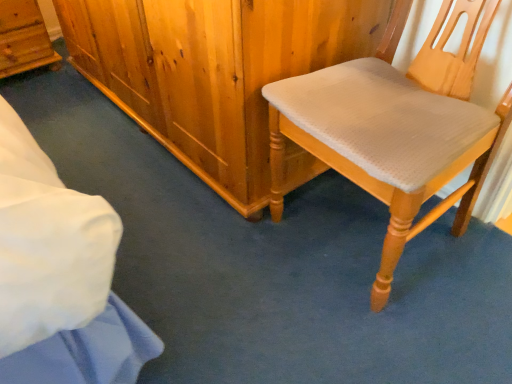
Identify the location of free region under light wood/texture chair at right (from a real-world perspective). The width and height of the screenshot is (512, 384). (355, 231).